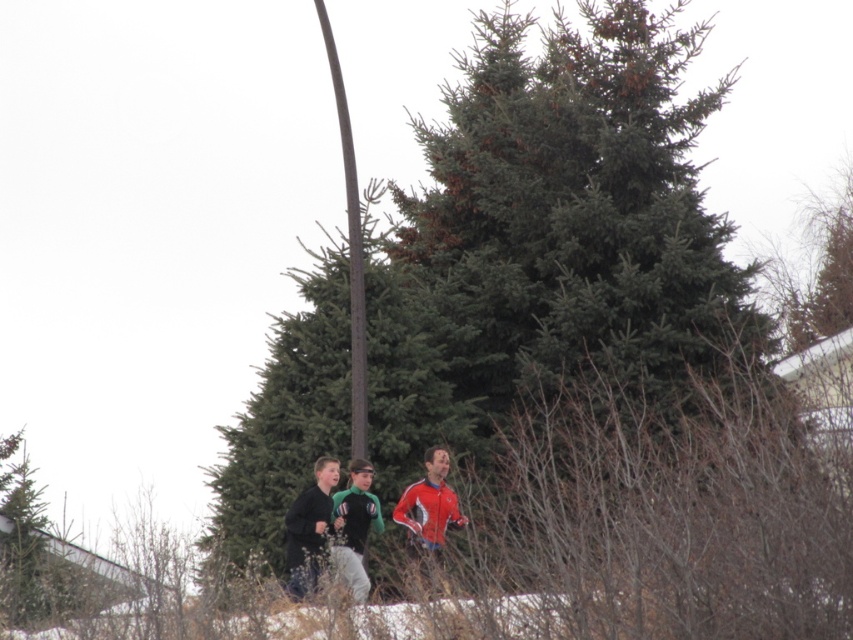
Question: Which point is farther to the camera?

Choices:
 (A) (346, 548)
 (B) (439, 492)
 (C) (355, 188)

Answer: (C)

Question: Among these points, which one is farthest from the camera?

Choices:
 (A) (297, 314)
 (B) (317, 515)
 (C) (364, 589)

Answer: (A)

Question: Where is green matte fir tree at center located in relation to red jacket at center in the image?

Choices:
 (A) below
 (B) above

Answer: (B)

Question: Does green matte fir tree at center appear under brown textured pole at center?

Choices:
 (A) no
 (B) yes

Answer: (A)

Question: Which point is farther to the camera?

Choices:
 (A) dark gray fleece jacket at lower center
 (B) green fabric jacket at center

Answer: (A)

Question: Is brown textured pole at center bigger than dark gray fleece jacket at lower center?

Choices:
 (A) no
 (B) yes

Answer: (B)